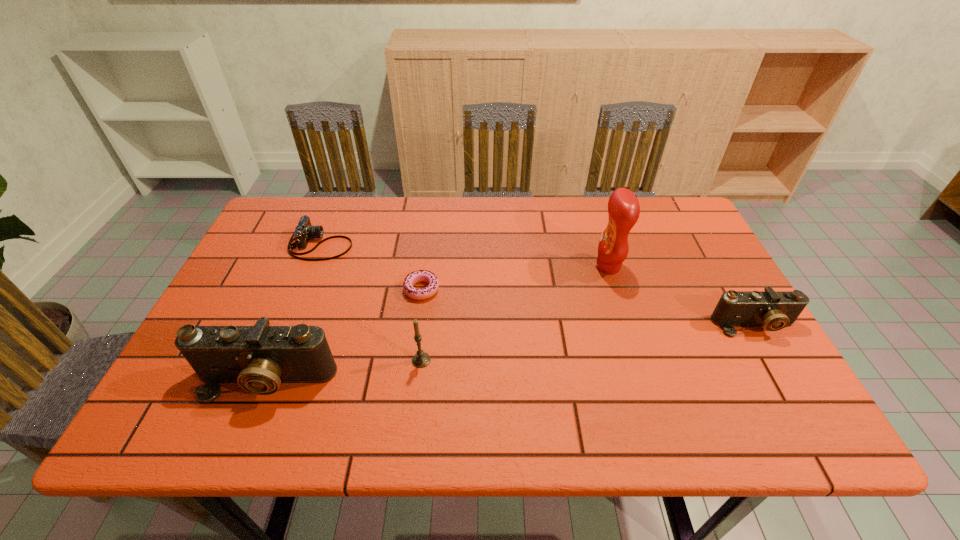
Identify the location of vacant area between the nearest camera and the candle. [344, 370].

Locate an element on the screen. The height and width of the screenshot is (540, 960). vacant space that is in between the shortest object and the tallest camera is located at coordinates (344, 335).

Where is `empty space between the candle and the second shortest object`? The width and height of the screenshot is (960, 540). empty space between the candle and the second shortest object is located at coordinates (372, 302).

At what (x,y) coordinates should I click in order to perform the action: click on free spot between the nearest camera and the tallest object. Please return your answer as a coordinate pair (x, y). The width and height of the screenshot is (960, 540). Looking at the image, I should click on tap(437, 323).

Find the location of a particular element. free space that is in between the shortest object and the second tallest camera is located at coordinates (588, 307).

Identify the location of free space between the shortest object and the condiment. (515, 278).

Image resolution: width=960 pixels, height=540 pixels. What are the coordinates of `free space between the rightmost object and the candle` in the screenshot? It's located at (588, 342).

Where is `the fourth closest object to the candle`? the fourth closest object to the candle is located at coordinates (623, 207).

Identify which object is the fifth nearest to the rightmost camera. Please provide its 2D coordinates. Your answer should be formatted as a tuple, i.e. [(x, y)], where the tuple contains the x and y coordinates of a point satisfying the conditions above.

[(304, 231)]

Choose which camera is the nearest neighbor to the farthest camera. Please provide its 2D coordinates. Your answer should be formatted as a tuple, i.e. [(x, y)], where the tuple contains the x and y coordinates of a point satisfying the conditions above.

[(259, 358)]